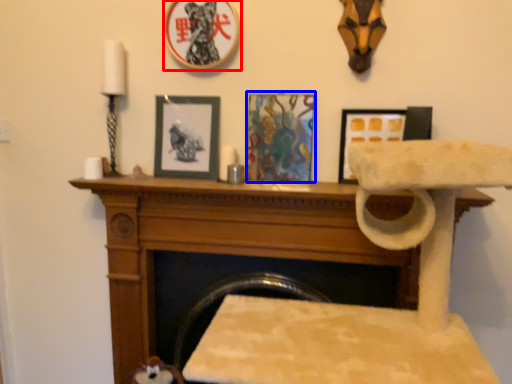
Question: Which object is further to the camera taking this photo, picture frame (highlighted by a red box) or picture frame (highlighted by a blue box)?

Choices:
 (A) picture frame
 (B) picture frame

Answer: (B)